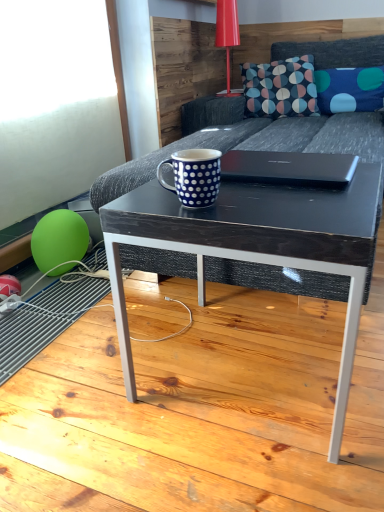
The width and height of the screenshot is (384, 512). Find the location of `free spot above black matte laptop at center (from a real-world perspective)`. free spot above black matte laptop at center (from a real-world perspective) is located at coordinates [280, 156].